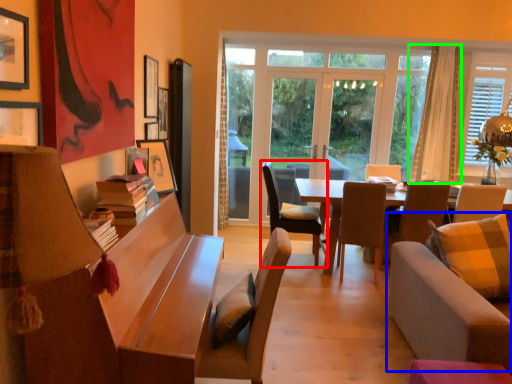
Question: Which is nearer to the chair (highlighted by a red box)? studio couch (highlighted by a blue box) or curtain (highlighted by a green box).

Choices:
 (A) studio couch
 (B) curtain

Answer: (A)